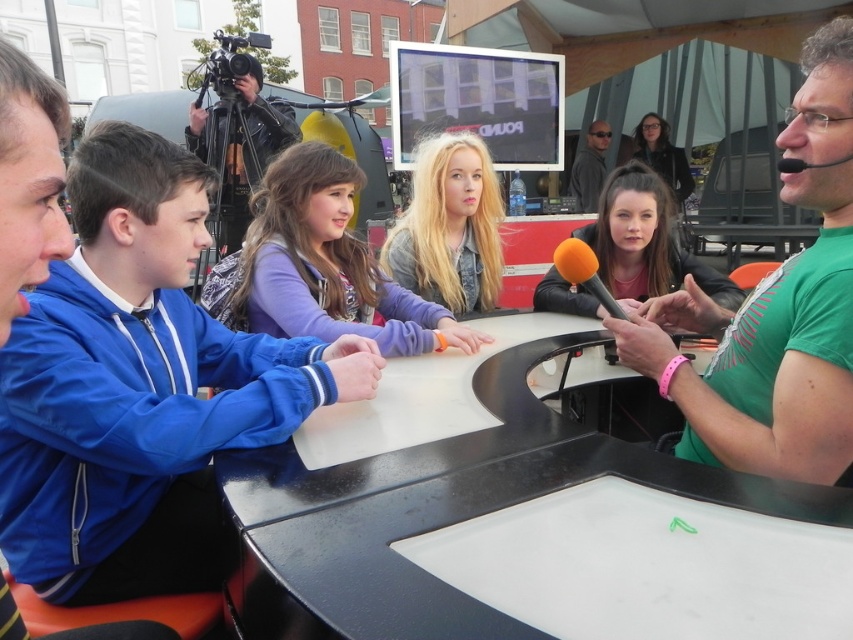
Question: Observing the image, what is the correct spatial positioning of green matte shirt at upper right in reference to black matte microphone at upper right?

Choices:
 (A) left
 (B) right

Answer: (A)

Question: Considering the real-world distances, which object is farthest from the black matte microphone at upper right?

Choices:
 (A) black leather jacket at upper left
 (B) orange foam microphone at center

Answer: (A)

Question: Which point appears farthest from the camera in this image?

Choices:
 (A) (160, 310)
 (B) (836, 289)
 (C) (793, 164)
 (D) (711, 273)

Answer: (D)

Question: Can you confirm if blonde hair at center is smaller than matte gray shirt at upper right?

Choices:
 (A) no
 (B) yes

Answer: (B)

Question: Does blue fabric jacket at left appear on the left side of matte black jacket at center?

Choices:
 (A) yes
 (B) no

Answer: (A)

Question: Which point is farther to the camera?

Choices:
 (A) (788, 164)
 (B) (637, 268)

Answer: (B)